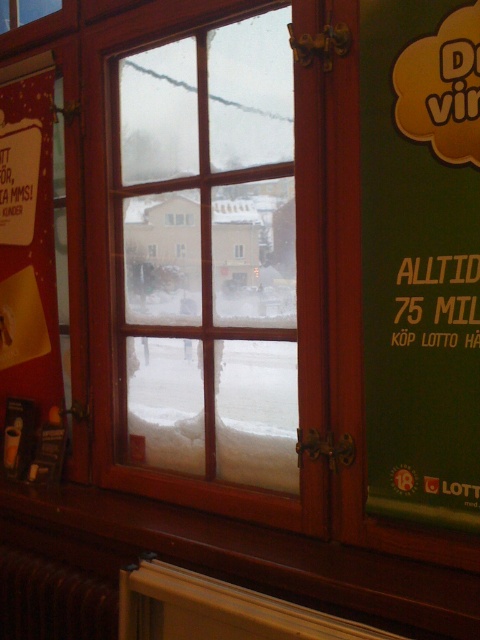
Question: From the image, what is the correct spatial relationship of wooden window at center in relation to matte red poster at left?

Choices:
 (A) below
 (B) above

Answer: (B)

Question: Does wooden window at center come in front of brown metallic radiator at lower left?

Choices:
 (A) yes
 (B) no

Answer: (A)

Question: Estimate the real-world distances between objects in this image. Which object is closer to the brown metallic radiator at lower left?

Choices:
 (A) wooden window at center
 (B) matte red poster at left

Answer: (B)

Question: Which of the following is the farthest from the observer?

Choices:
 (A) (152, 182)
 (B) (9, 561)
 (C) (36, 230)

Answer: (C)

Question: Is wooden window at center smaller than matte red poster at left?

Choices:
 (A) yes
 (B) no

Answer: (B)

Question: Which point is closer to the camera?

Choices:
 (A) wooden window at center
 (B) matte red poster at left

Answer: (A)